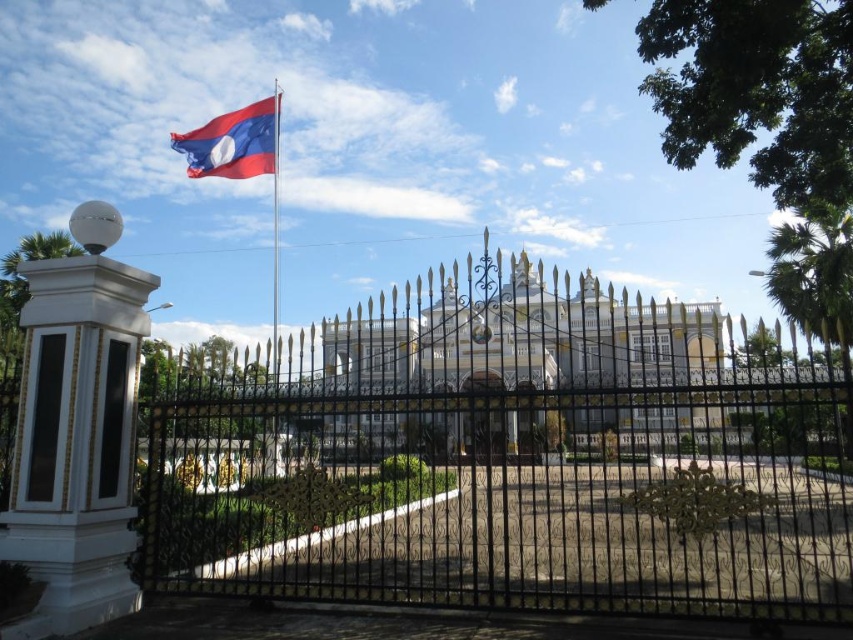
Is black wrought iron fence at center further to camera compared to white glossy column at left?

No, it is in front of white glossy column at left.

Does black wrought iron fence at center come in front of white glossy column at left?

Yes, it is.

Is point (375, 595) positioned after point (67, 360)?

Yes, it is behind point (67, 360).

The width and height of the screenshot is (853, 640). I want to click on black wrought iron fence at center, so click(x=515, y=496).

Is black wrought iron fence at center behind metallic flag pole at upper left?

No.

Is black wrought iron fence at center thinner than metallic flag pole at upper left?

No, black wrought iron fence at center is not thinner than metallic flag pole at upper left.

Locate an element on the screen. The image size is (853, 640). black wrought iron fence at center is located at coordinates (515, 496).

Is red matte flag at upper left taller than metallic flag pole at upper left?

Incorrect, red matte flag at upper left's height is not larger of metallic flag pole at upper left's.

Which of these two, red matte flag at upper left or metallic flag pole at upper left, stands taller?

metallic flag pole at upper left is taller.

This screenshot has width=853, height=640. What do you see at coordinates (233, 141) in the screenshot?
I see `red matte flag at upper left` at bounding box center [233, 141].

Find the location of a particular element. red matte flag at upper left is located at coordinates (233, 141).